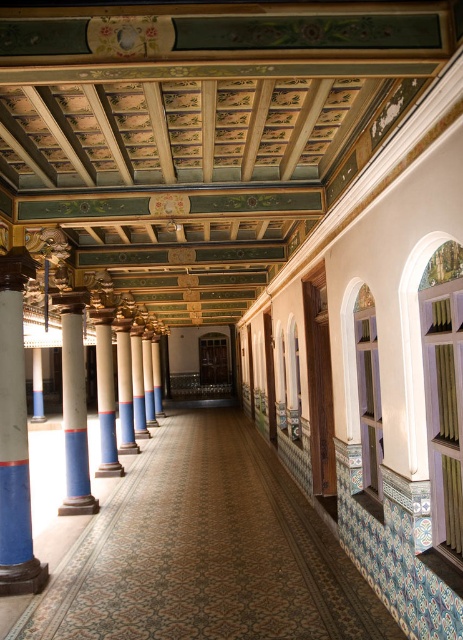
You are standing in the corridor and want to locate the marble column at left. Which direction should you face to see it?

The marble column at left is located at point (14, 435), so you should face the left side of the corridor to see it.

You are an architect designing a new building and want to ensure that the columns in the corridor are proportionate. Given the marble column at left and the white glossy column at center, which column should be placed in a position where height is a critical factor for structural support?

The marble column at left should be placed where height is critical because it is much taller than the white glossy column at center, providing better structural support.